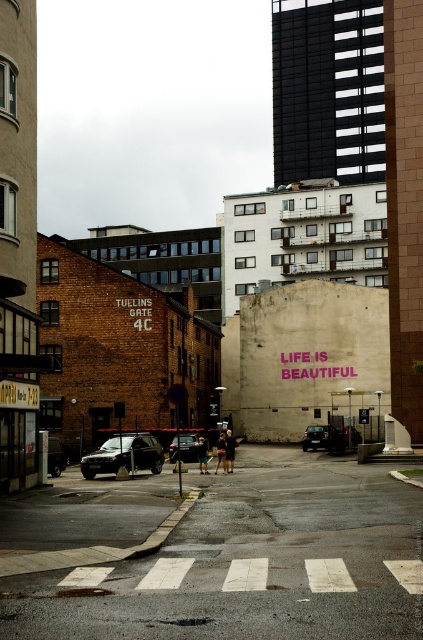
Is matte black car at center taller than shiny silver sedan at center?

Yes.

Is matte black car at center below shiny silver sedan at center?

Indeed, matte black car at center is positioned under shiny silver sedan at center.

What do you see at coordinates (321, 436) in the screenshot? This screenshot has width=423, height=640. I see `matte black car at center` at bounding box center [321, 436].

Identify the location of matte black car at center. (321, 436).

Does shiny black suv at center have a lesser width compared to dark gray metallic car at center-left?

No, shiny black suv at center is not thinner than dark gray metallic car at center-left.

Where is `shiny black suv at center`? The image size is (423, 640). shiny black suv at center is located at coordinates (123, 456).

Does shiny black suv at center appear on the left side of matte black car at center?

Yes, shiny black suv at center is to the left of matte black car at center.

Measure the distance from shiny black suv at center to matte black car at center.

A distance of 22.21 meters exists between shiny black suv at center and matte black car at center.

Is point (150, 451) behind point (312, 426)?

That is False.

At what (x,y) coordinates should I click in order to perform the action: click on shiny black suv at center. Please return your answer as a coordinate pair (x, y). The height and width of the screenshot is (640, 423). Looking at the image, I should click on (123, 456).